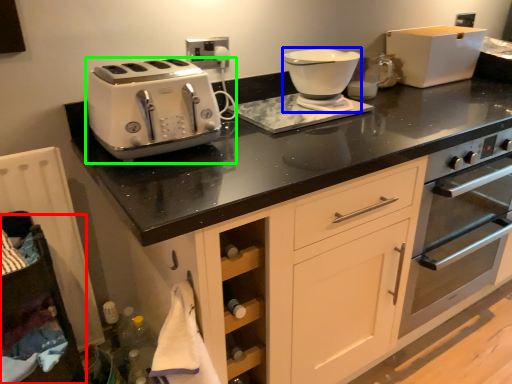
Question: Which object is positioned farthest from cabinetry (highlighted by a red box)? Select from food processor (highlighted by a blue box) and toaster (highlighted by a green box).

Choices:
 (A) food processor
 (B) toaster

Answer: (A)